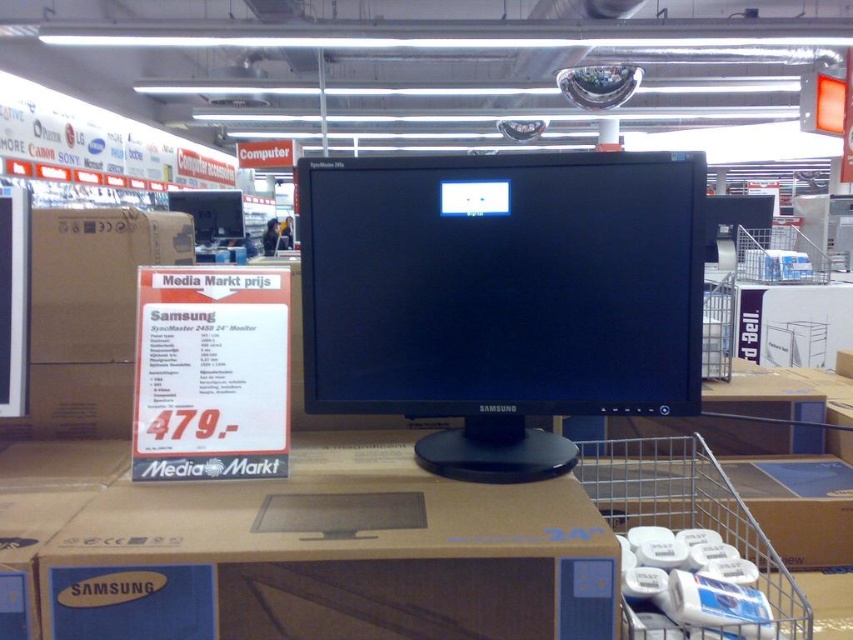
Question: Is matte black monitor at center further to the viewer compared to matte black monitor at upper center?

Choices:
 (A) yes
 (B) no

Answer: (B)

Question: Is matte black monitor at center to the right of matte black monitor at upper center from the viewer's perspective?

Choices:
 (A) yes
 (B) no

Answer: (A)

Question: Is matte black monitor at center positioned before matte black monitor at upper center?

Choices:
 (A) yes
 (B) no

Answer: (A)